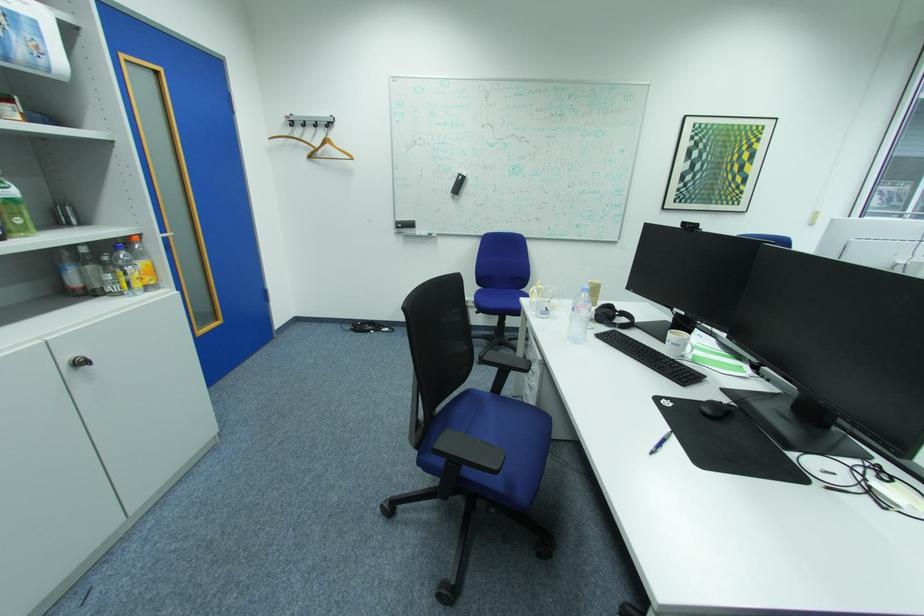
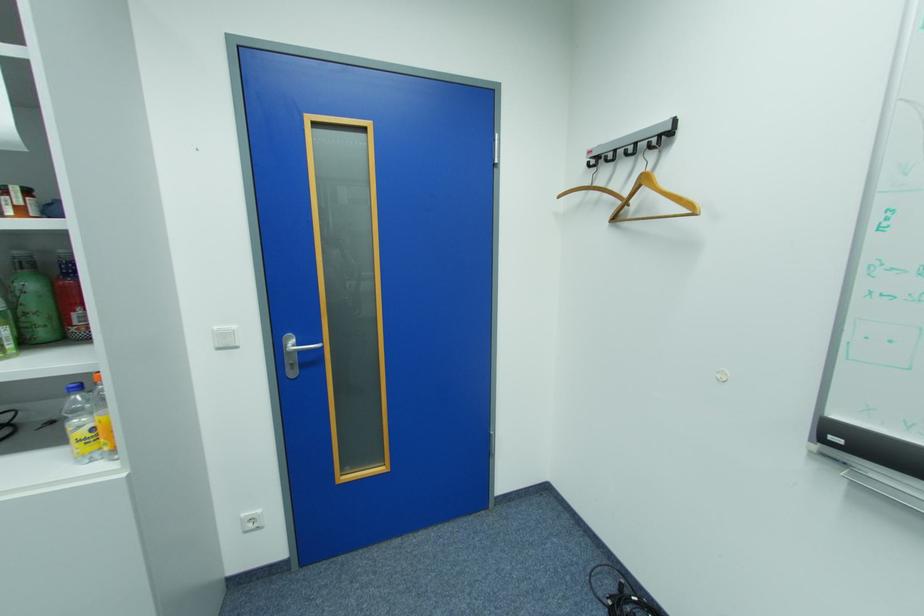
In the second image, find the point that corresponds to (320,156) in the first image.

(624, 220)